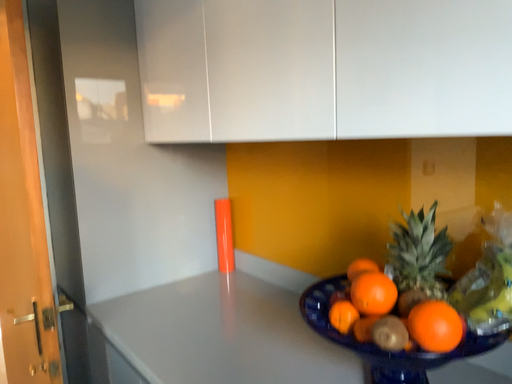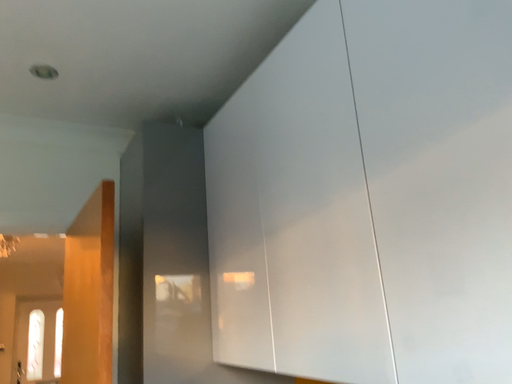
Question: How did the camera likely rotate when shooting the video?

Choices:
 (A) rotated right
 (B) rotated left

Answer: (B)